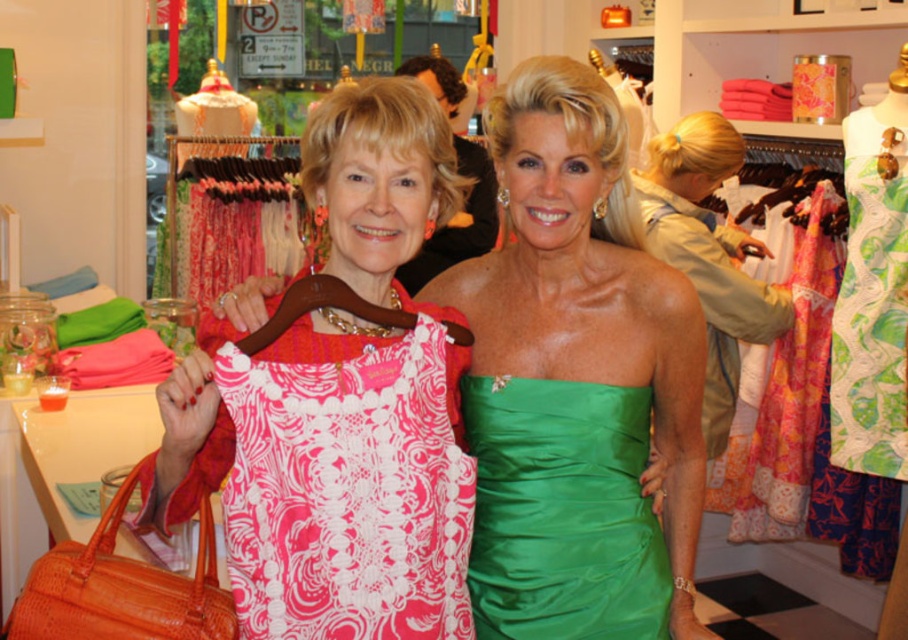
You are standing at the entrance of the clothing store and want to find the pink lace dress at center. According to the store layout, which direction should you move to locate it?

The pink lace dress at center is located at point (348, 484), so you should move towards the center of the store to find it.

Consider the image. You are a customer in the store and want to examine the pink lace dress at center closely. If you move forward 2 feet, will you be able to see the dress more clearly?

Since the pink lace dress at center is currently 3.68 feet away from you, moving forward 2 feet would bring you to 1.68 feet away, allowing you to see it more clearly.

You are a customer in the store and want to try on both the pink lace dress at center and the green satin dress at center. The changing room has a narrow entrance that can only accommodate a dress with a width of 1 meter. Which dress should you try first to ensure it fits through the entrance?

The green satin dress at center has a smaller width than the pink lace dress at center. Since the entrance can only accommodate a dress with a width of 1 meter, you should try the green satin dress at center first to ensure it fits through the entrance before attempting the wider pink lace dress at center.